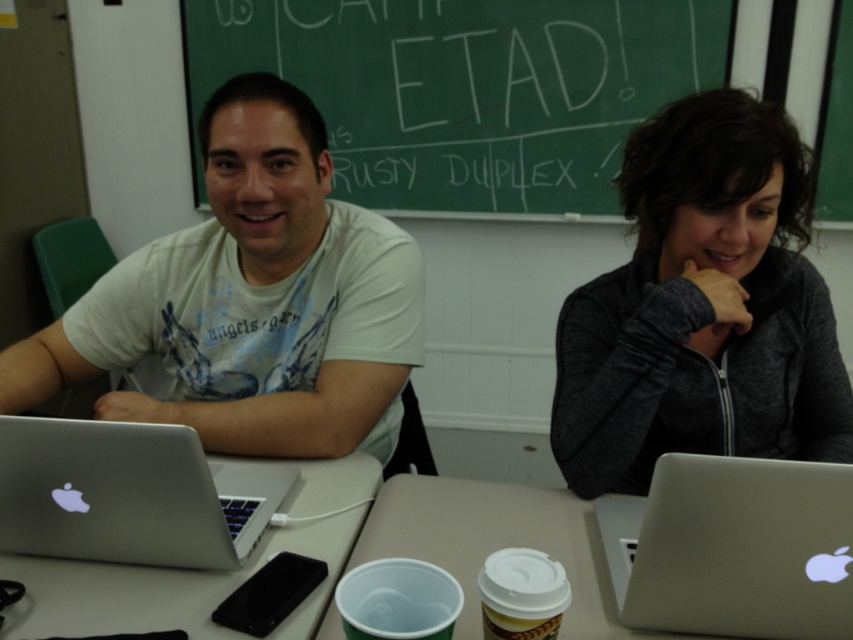
Question: Can you confirm if sleek silver laptop at center is positioned to the right of silver metallic laptop at left?

Choices:
 (A) yes
 (B) no

Answer: (A)

Question: Which point appears closest to the camera in this image?

Choices:
 (A) (697, 609)
 (B) (358, 406)

Answer: (A)

Question: Estimate the real-world distances between objects in this image. Which object is closer to the white matte shirt at center?

Choices:
 (A) sleek silver laptop at center
 (B) green chalkboard at upper center
 (C) dark gray fleece jacket at right
 (D) silver metallic laptop at left

Answer: (D)

Question: Is sleek silver laptop at center in front of white plastic cup at center?

Choices:
 (A) no
 (B) yes

Answer: (B)

Question: Which point is farther to the camera?

Choices:
 (A) white plastic cup at center
 (B) white matte shirt at center

Answer: (B)

Question: Does sleek silver laptop at center have a smaller size compared to white plastic cup at center?

Choices:
 (A) yes
 (B) no

Answer: (B)